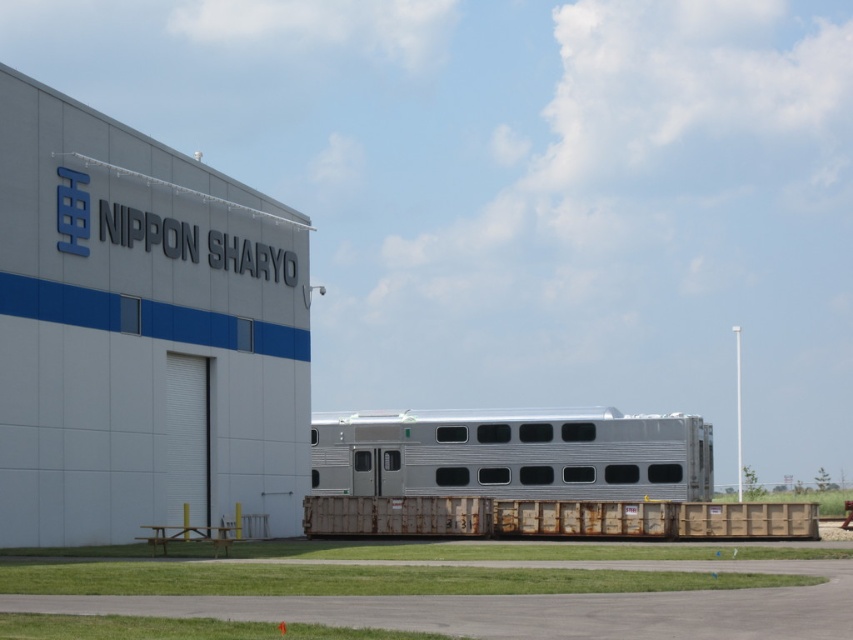
Question: Considering the relative positions of gray matte building at upper left and silver/aluminum passenger train at center in the image provided, where is gray matte building at upper left located with respect to silver/aluminum passenger train at center?

Choices:
 (A) right
 (B) left

Answer: (B)

Question: Which of these objects is positioned farthest from the gray matte building at upper left?

Choices:
 (A) brown wooden train at center
 (B) silver/aluminum passenger train at center

Answer: (B)

Question: Among these points, which one is nearest to the camera?

Choices:
 (A) (791, 515)
 (B) (677, 419)

Answer: (A)

Question: Is silver/aluminum passenger train at center smaller than brown wooden train at center?

Choices:
 (A) yes
 (B) no

Answer: (B)

Question: Which object is the closest to the gray matte building at upper left?

Choices:
 (A) brown wooden train at center
 (B) silver/aluminum passenger train at center

Answer: (A)

Question: Does gray matte building at upper left have a smaller size compared to brown wooden train at center?

Choices:
 (A) no
 (B) yes

Answer: (A)